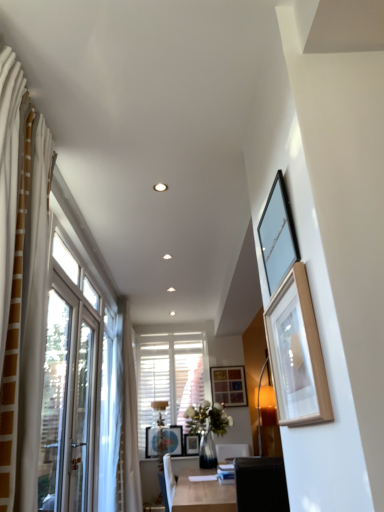
Question: Is wooden picture frame at upper right, acting as the fourth picture frame starting from the left, further to camera compared to matte black picture frame at upper right, the 5th picture frame ordered from the bottom?

Choices:
 (A) yes
 (B) no

Answer: (B)

Question: Does wooden picture frame at upper right, the 5th picture frame from the back, lie in front of matte black picture frame at upper right, the 3th picture frame in the right-to-left sequence?

Choices:
 (A) no
 (B) yes

Answer: (B)

Question: From the image's perspective, is wooden picture frame at upper right, marked as the second picture frame in a right-to-left arrangement, located beneath matte black picture frame at upper right, the 5th picture frame ordered from the bottom?

Choices:
 (A) no
 (B) yes

Answer: (B)

Question: Does wooden picture frame at upper right, the 4th picture frame when ordered from bottom to top, have a greater height compared to matte black picture frame at upper right, the 3th picture frame in the right-to-left sequence?

Choices:
 (A) no
 (B) yes

Answer: (B)

Question: Considering the relative positions of wooden picture frame at upper right, marked as the second picture frame in a right-to-left arrangement, and matte black picture frame at upper right, the fourth picture frame positioned from the back, in the image provided, is wooden picture frame at upper right, marked as the second picture frame in a right-to-left arrangement, to the left of matte black picture frame at upper right, the fourth picture frame positioned from the back, from the viewer's perspective?

Choices:
 (A) no
 (B) yes

Answer: (A)

Question: Can we say wooden picture frame at upper right, acting as the fourth picture frame starting from the left, lies outside matte black picture frame at upper right, the 5th picture frame ordered from the bottom?

Choices:
 (A) no
 (B) yes

Answer: (B)

Question: Is matte black picture frame at upper right, the fourth picture frame positioned from the back, looking in the opposite direction of wooden picture frame at center, placed as the first picture frame when sorted from bottom to top?

Choices:
 (A) yes
 (B) no

Answer: (B)

Question: From the image's perspective, does matte black picture frame at upper right, the fourth picture frame positioned from the back, appear higher than wooden picture frame at center, placed as the first picture frame when sorted from bottom to top?

Choices:
 (A) no
 (B) yes

Answer: (B)

Question: Can you confirm if matte black picture frame at upper right, the 1th picture frame from the top, is positioned to the left of wooden picture frame at center, placed as the first picture frame when sorted from bottom to top?

Choices:
 (A) no
 (B) yes

Answer: (A)

Question: Is matte black picture frame at upper right, the fourth picture frame positioned from the back, wider than wooden picture frame at center, acting as the fifth picture frame starting from the top?

Choices:
 (A) yes
 (B) no

Answer: (B)

Question: Does matte black picture frame at upper right, the fourth picture frame positioned from the back, have a smaller size compared to wooden picture frame at center, acting as the fifth picture frame starting from the top?

Choices:
 (A) yes
 (B) no

Answer: (B)

Question: From a real-world perspective, is matte black picture frame at upper right, which appears as the 3th picture frame when viewed from the left, located higher than wooden picture frame at center, the 2th picture frame viewed from the back?

Choices:
 (A) no
 (B) yes

Answer: (B)

Question: Can you confirm if wooden picture frame at center, the second picture frame viewed from the left, is shorter than light wood table at center?

Choices:
 (A) no
 (B) yes

Answer: (B)